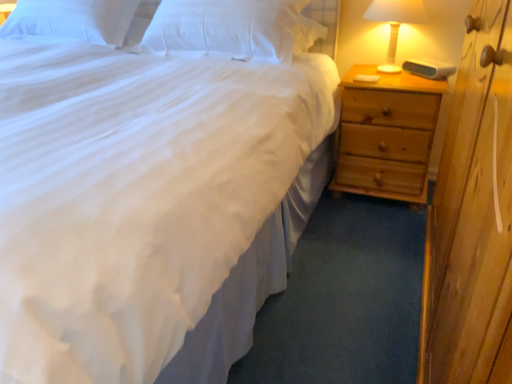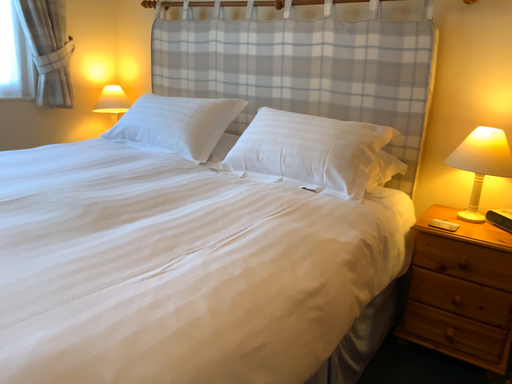
Question: How did the camera likely rotate when shooting the video?

Choices:
 (A) rotated left
 (B) rotated right

Answer: (A)